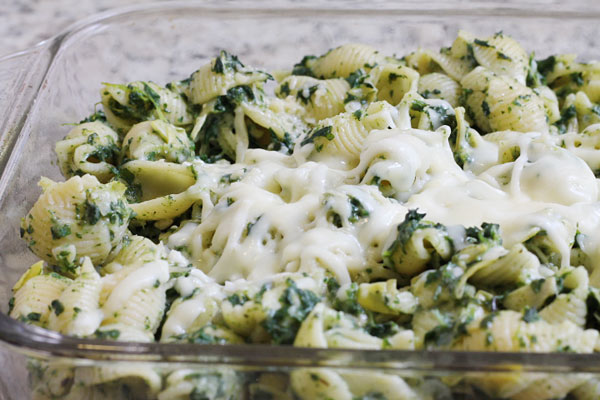
This screenshot has height=400, width=600. What are the coordinates of `table` in the screenshot? It's located at (22, 23).